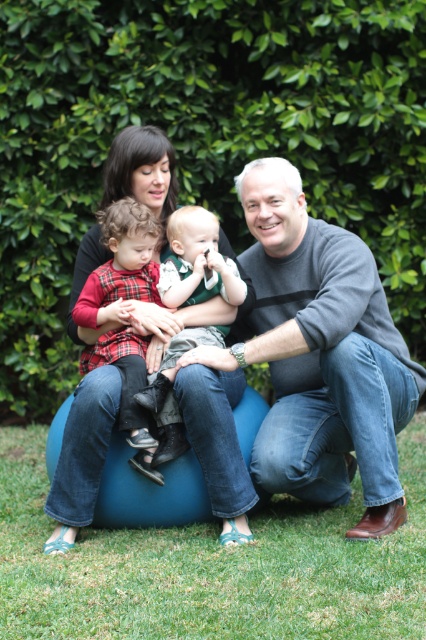
You are a photographer setting up a shoot in the scene described. You need to place a small prop between the gray sweater at center and the plaid fabric shirt at left. Based on their positions, where should you place the prop to ensure it is between them?

The gray sweater at center is positioned under the plaid fabric shirt at left, so placing the prop between them would require positioning it above the gray sweater at center and below the plaid fabric shirt at left.